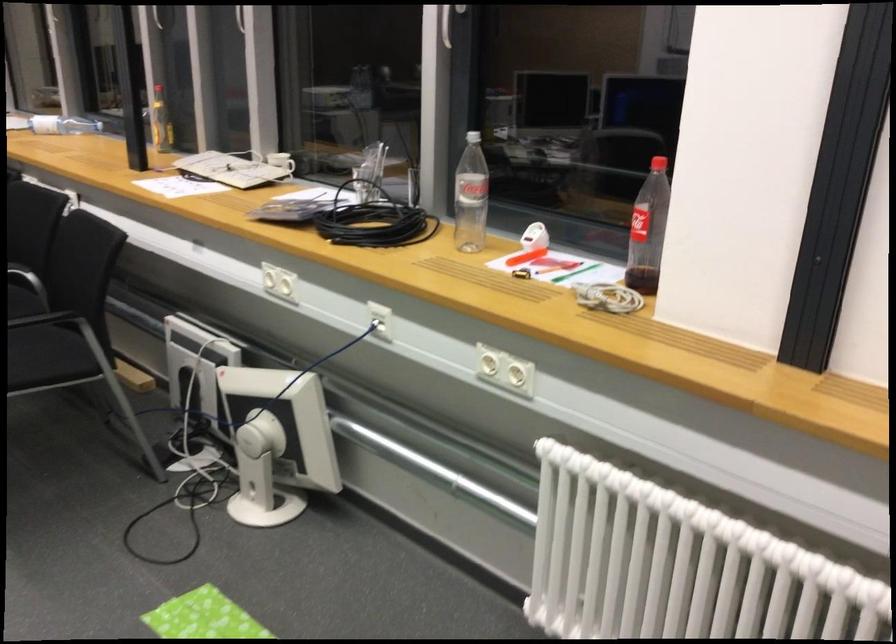
The width and height of the screenshot is (896, 644). In order to click on black chair sitting surface in this screenshot , I will do `click(47, 357)`.